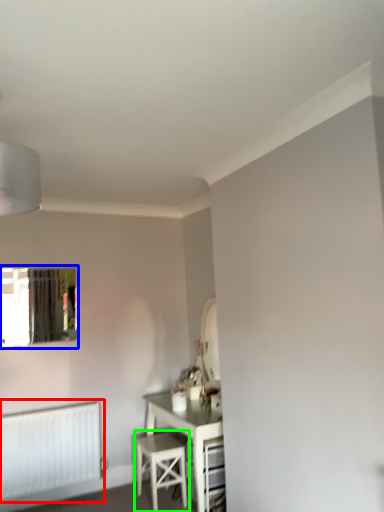
Question: Which object is positioned closest to radiator (highlighted by a red box)? Select from window (highlighted by a blue box) and stool (highlighted by a green box).

Choices:
 (A) window
 (B) stool

Answer: (B)